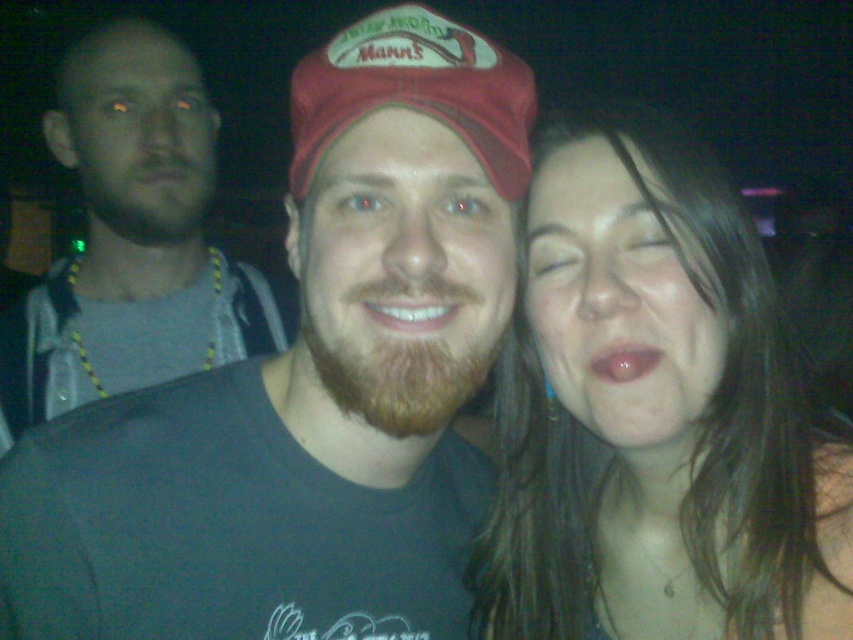
Question: Estimate the real-world distances between objects in this image. Which object is closer to the brownhairbeard at left?

Choices:
 (A) matte dark gray t-shirt at center
 (B) smooth skin face at center
 (C) gray fabric shirt at left
 (D) pink glossy lips at center

Answer: (C)

Question: Can you confirm if brown matte beard at center is thinner than white glossy teeth at center?

Choices:
 (A) yes
 (B) no

Answer: (B)

Question: Is smooth skin face at center positioned behind brown fuzzy beard at center?

Choices:
 (A) yes
 (B) no

Answer: (A)

Question: Is red fabric cap at center closer to the viewer compared to white glossy teeth at center?

Choices:
 (A) yes
 (B) no

Answer: (B)

Question: Which point is closer to the camera?

Choices:
 (A) matte dark gray t-shirt at center
 (B) pink glossy lips at center

Answer: (A)

Question: Which point is farther from the camera taking this photo?

Choices:
 (A) (111, 205)
 (B) (321, 140)

Answer: (A)